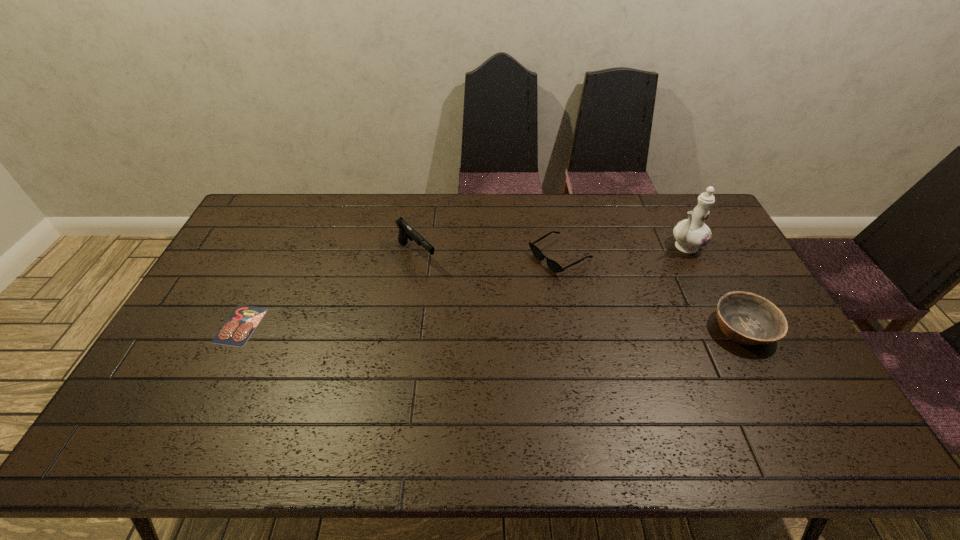
Locate an element on the screen. free space between the third object from right to left and the fourth shortest object is located at coordinates (489, 256).

Identify the location of vacant space in between the second tallest object and the sunglasses. The image size is (960, 540). (489, 256).

The width and height of the screenshot is (960, 540). I want to click on free space that is in between the tallest object and the sunglasses, so click(622, 251).

Identify the location of unoccupied position between the fourth object from right to left and the tallest object. (551, 251).

At what (x,y) coordinates should I click in order to perform the action: click on vacant area between the shortest object and the chinaware. Please return your answer as a coordinate pair (x, y). The image size is (960, 540). Looking at the image, I should click on (463, 286).

Find the location of `free space between the third tallest object and the fourth shortest object`. free space between the third tallest object and the fourth shortest object is located at coordinates (580, 292).

Locate an element on the screen. The height and width of the screenshot is (540, 960). vacant space in between the chinaware and the second shortest object is located at coordinates (622, 251).

Identify which object is the second nearest to the bowl. Please provide its 2D coordinates. Your answer should be formatted as a tuple, i.e. [(x, y)], where the tuple contains the x and y coordinates of a point satisfying the conditions above.

[(553, 265)]

Where is `the closest object relative to the bowl`? This screenshot has width=960, height=540. the closest object relative to the bowl is located at coordinates (692, 233).

What are the coordinates of `free space that satisfies the following two spatial constraints: 1. on the front side of the second object from left to right; 2. on the right side of the third tallest object` in the screenshot? It's located at (406, 328).